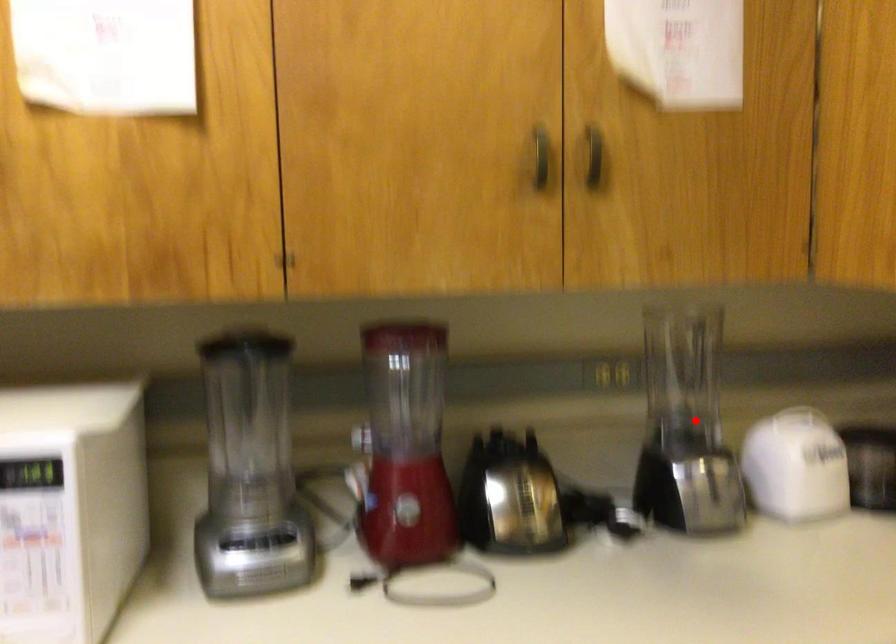
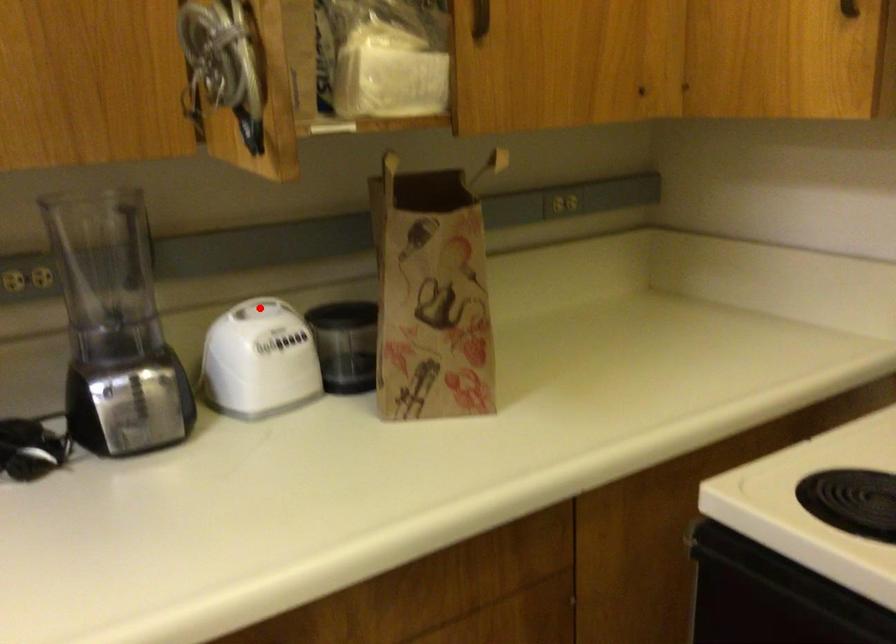
I am providing you with two images of the same scene from different viewpoints. A red point is marked on the first image and another point is marked on the second image. Is the marked point in image1 the same physical position as the marked point in image2?

No